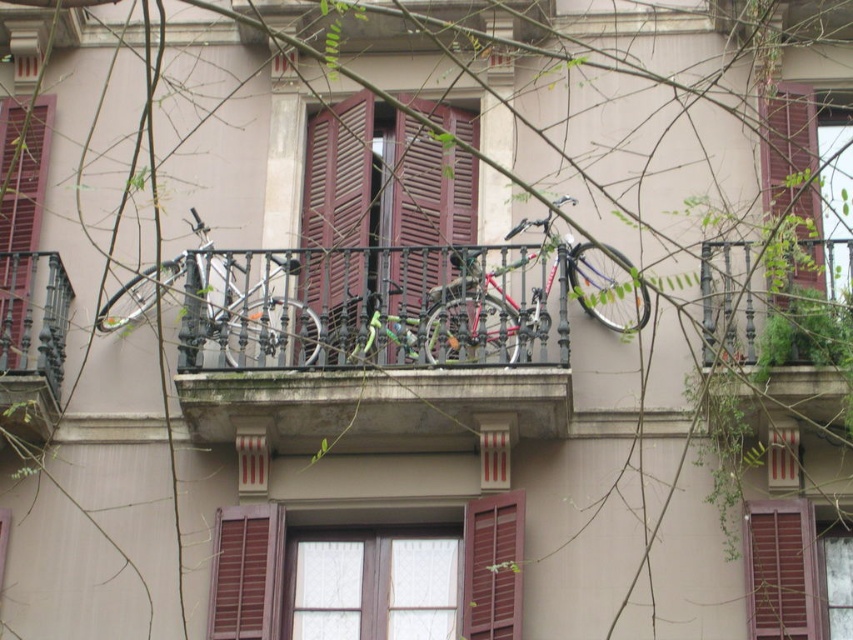
Question: Which object is closer to the camera taking this photo?

Choices:
 (A) brown wooden shutter at lower center
 (B) wooden shutter at lower right

Answer: (B)

Question: Does metallic bicycle at center appear on the left side of black wrought iron balcony at center?

Choices:
 (A) no
 (B) yes

Answer: (A)

Question: Observing the image, what is the correct spatial positioning of metallic bicycle at center in reference to wooden shuttered window at lower right?

Choices:
 (A) left
 (B) right

Answer: (A)

Question: Which point is farther from the camera taking this photo?

Choices:
 (A) (746, 508)
 (B) (50, 403)

Answer: (B)

Question: Which object is the farthest from the wooden shuttered window at lower right?

Choices:
 (A) metallic bicycle at center
 (B) wooden shutter at left

Answer: (B)

Question: Does wooden shutter at lower right have a greater width compared to brown wooden shutter at lower left?

Choices:
 (A) yes
 (B) no

Answer: (A)